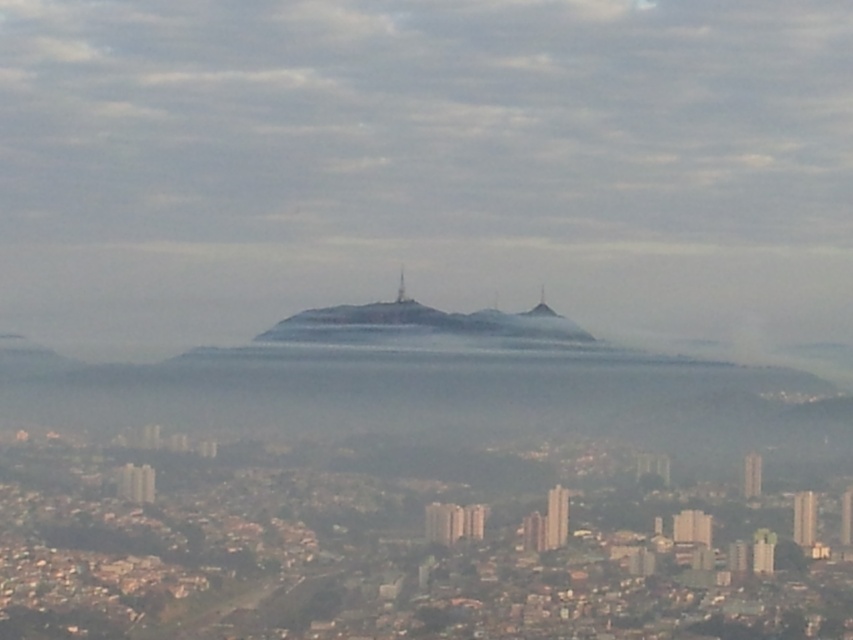
Between foggy misty mountain at center and smooth stone peak at center, which one is positioned higher?

foggy misty mountain at center is higher up.

Is point (410, 138) closer to camera compared to point (537, 310)?

No, it is not.

Locate an element on the screen. foggy misty mountain at center is located at coordinates (425, 166).

Image resolution: width=853 pixels, height=640 pixels. What do you see at coordinates (425, 166) in the screenshot?
I see `foggy misty mountain at center` at bounding box center [425, 166].

Between foggy misty mountain at center and foggy gray mountain at center, which one appears on the right side from the viewer's perspective?

foggy gray mountain at center

The height and width of the screenshot is (640, 853). What do you see at coordinates (425, 166) in the screenshot?
I see `foggy misty mountain at center` at bounding box center [425, 166].

Identify the location of foggy misty mountain at center. (425, 166).

Who is taller, foggy gray mountain at center or smooth stone peak at center?

foggy gray mountain at center is taller.

Is foggy gray mountain at center positioned before smooth stone peak at center?

Yes, it is in front of smooth stone peak at center.

Which is in front, point (322, 323) or point (546, 310)?

Positioned in front is point (322, 323).

The width and height of the screenshot is (853, 640). In order to click on foggy gray mountain at center in this screenshot , I will do `click(422, 326)`.